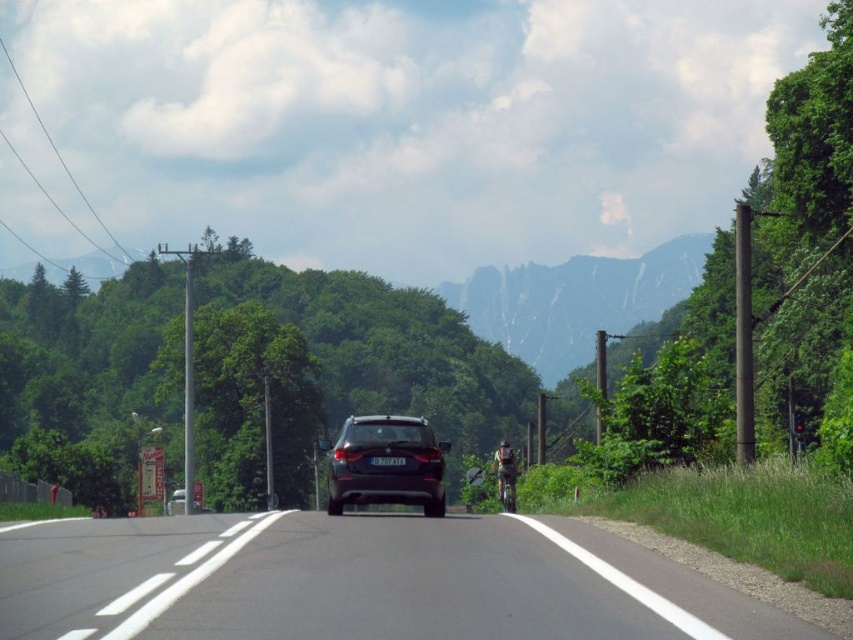
You are a driver approaching the black asphalt road at center and the green fabric jacket at center. Which object takes up more visual space in the scene?

The green fabric jacket at center occupies more visual space than the black asphalt road at center.

You are a pedestrian standing on the side of the road. You see a satin black car at center and a green fabric jacket at center. Which object takes up more space horizontally?

The satin black car at center is wider than the green fabric jacket at center, so it takes up more horizontal space.